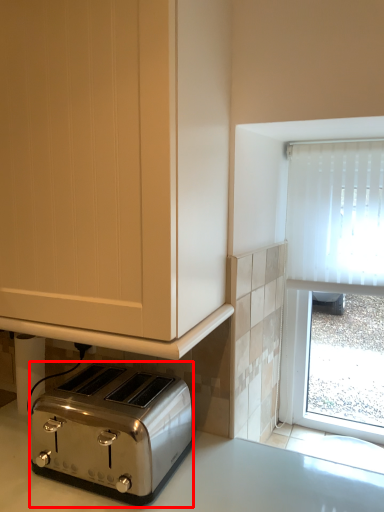
Question: From the image's perspective, what is the correct spatial relationship of toaster (annotated by the red box) in relation to cabinetry?

Choices:
 (A) below
 (B) above

Answer: (A)